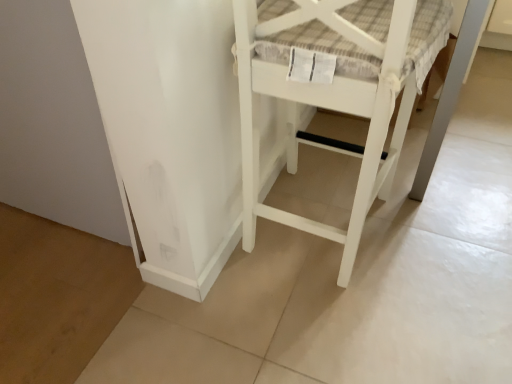
Where is `unoccupied region to the right of white wood chair at center`? This screenshot has width=512, height=384. unoccupied region to the right of white wood chair at center is located at coordinates (458, 239).